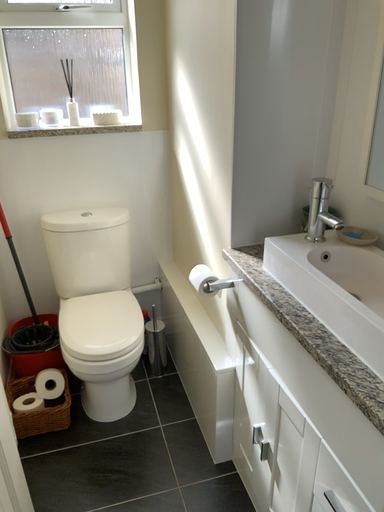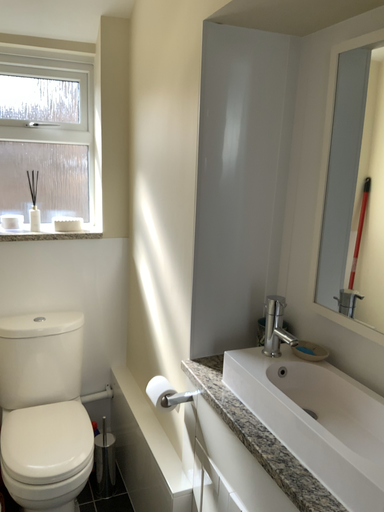
Question: How did the camera likely rotate when shooting the video?

Choices:
 (A) rotated right
 (B) rotated left

Answer: (A)